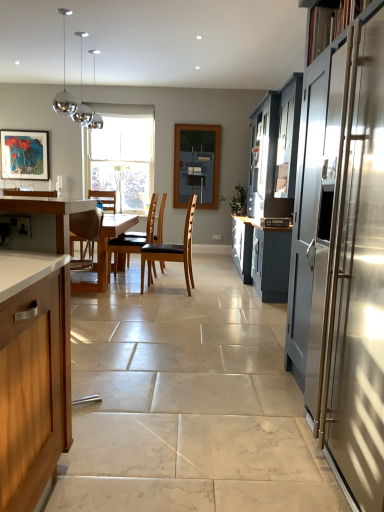
This screenshot has height=512, width=384. What are the coordinates of `vacant region to the left of stainless steel cabinet at right, the second cabinetry viewed from the left` in the screenshot? It's located at (230, 459).